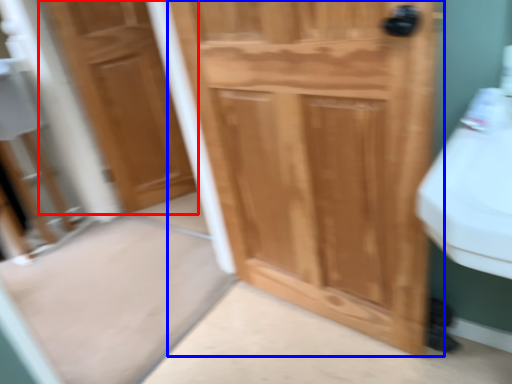
Question: Which object is closer to the camera taking this photo, door (highlighted by a red box) or door (highlighted by a blue box)?

Choices:
 (A) door
 (B) door

Answer: (B)